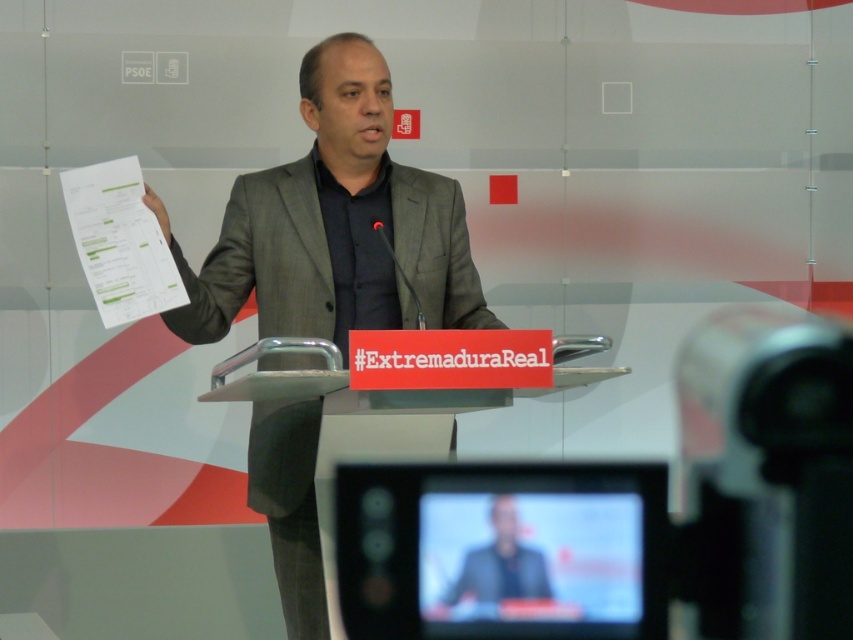
Question: Which point is farther from the camera taking this photo?

Choices:
 (A) pyautogui.click(x=256, y=182)
 (B) pyautogui.click(x=505, y=557)

Answer: (B)

Question: Which point is closer to the camera?

Choices:
 (A) dark gray suit at center
 (B) gray suit at center

Answer: (B)

Question: Does gray suit at center lie in front of dark gray suit at center?

Choices:
 (A) yes
 (B) no

Answer: (A)

Question: Does gray suit at center lie behind dark gray suit at center?

Choices:
 (A) yes
 (B) no

Answer: (B)

Question: Does gray suit at center appear on the right side of dark gray suit at center?

Choices:
 (A) yes
 (B) no

Answer: (B)